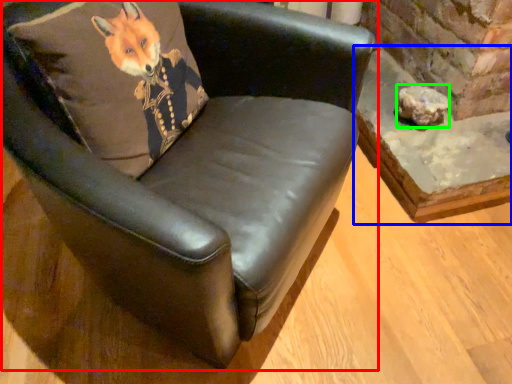
Question: Which object is positioned farthest from chair (highlighted by a red box)? Select from table (highlighted by a blue box) and stone (highlighted by a green box).

Choices:
 (A) table
 (B) stone

Answer: (B)